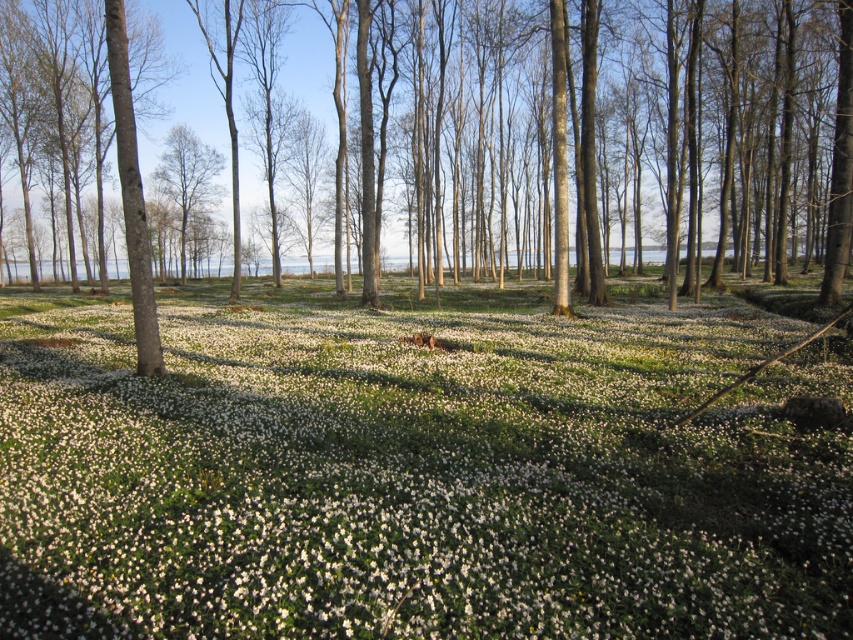
Is white matte flowers at center taller than smooth bark tree at center?

No, white matte flowers at center is not taller than smooth bark tree at center.

Is the position of white matte flowers at center less distant than that of smooth bark tree at center?

Yes, white matte flowers at center is closer to the viewer.

This screenshot has height=640, width=853. Identify the location of white matte flowers at center. (416, 467).

At what (x,y) coordinates should I click in order to perform the action: click on white matte flowers at center. Please return your answer as a coordinate pair (x, y). Image resolution: width=853 pixels, height=640 pixels. Looking at the image, I should click on (416, 467).